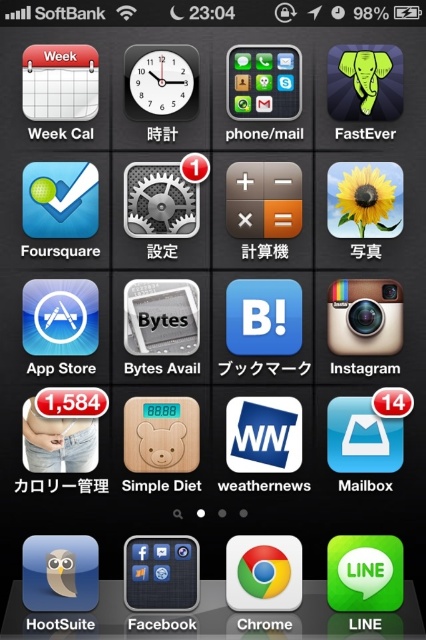
Consider the image. You are looking at the smartphone home screen and notice two points marked on the screen. Which point is closer to you, point at position (235, 579) or point at position (284, 106)?

Point at position (235, 579) is closer to the viewer than point at position (284, 106).